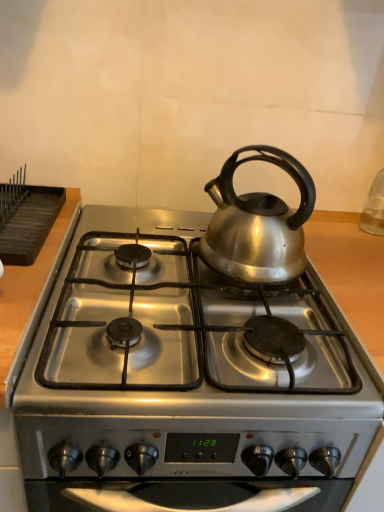
Question: In terms of height, does black matte rack at upper left look taller or shorter compared to satin silver gas stove at center?

Choices:
 (A) tall
 (B) short

Answer: (B)

Question: Does point (21, 264) appear closer or farther from the camera than point (56, 355)?

Choices:
 (A) farther
 (B) closer

Answer: (A)

Question: Which of these objects is positioned closest to the satin silver gas stove at center?

Choices:
 (A) silver metallic kettle at center
 (B) black matte rack at upper left

Answer: (A)

Question: Based on their relative distances, which object is farther from the satin silver gas stove at center?

Choices:
 (A) silver metallic kettle at center
 (B) black matte rack at upper left

Answer: (B)